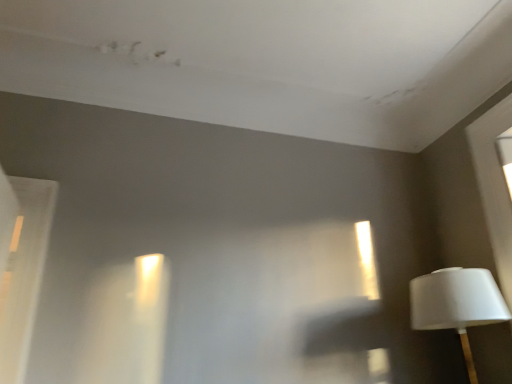
Question: Is white glossy door at left bigger or smaller than white matte lampshade at right?

Choices:
 (A) small
 (B) big

Answer: (B)

Question: Would you say white glossy door at left is to the left or to the right of white matte lampshade at right in the picture?

Choices:
 (A) left
 (B) right

Answer: (A)

Question: From the image's perspective, is white glossy door at left positioned above or below white matte lampshade at right?

Choices:
 (A) above
 (B) below

Answer: (A)

Question: Is white matte lampshade at right bigger or smaller than white glossy door at left?

Choices:
 (A) big
 (B) small

Answer: (B)

Question: Is white matte lampshade at right in front of or behind white glossy door at left in the image?

Choices:
 (A) front
 (B) behind

Answer: (B)

Question: Is white matte lampshade at right taller or shorter than white glossy door at left?

Choices:
 (A) tall
 (B) short

Answer: (B)

Question: From a real-world perspective, is white matte lampshade at right physically located above or below white glossy door at left?

Choices:
 (A) below
 (B) above

Answer: (A)